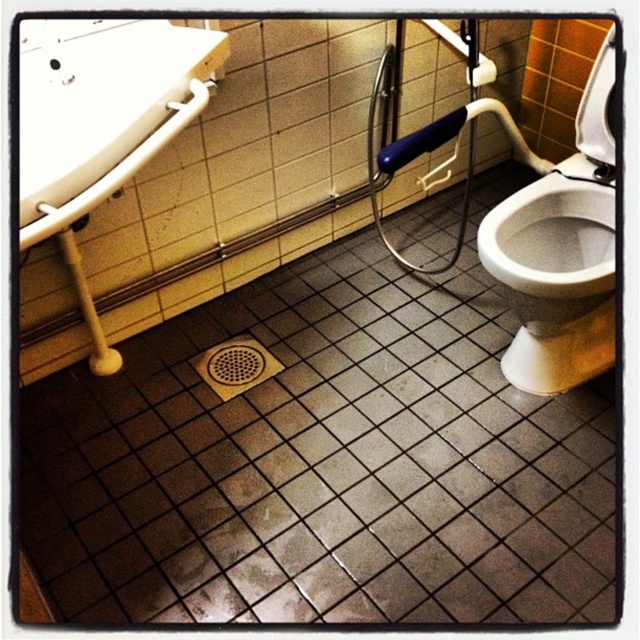
You are standing in the bathroom and need to locate the white glossy sink at upper left and the brown textured drain at center. Which object is closer to the left wall?

The white glossy sink at upper left is closer to the left wall since it is positioned on the left side of the brown textured drain at center.

You are standing in the bathroom and want to reach a specific point on the floor marked at coordinates point (368,445). If you are currently 1.5 meters away from that point, how much further do you need to move forward to reach it?

The distance of point (368,445) from viewer is 1.70 meters. Since you are currently 1.5 meters away, you need to move forward an additional 0.2 meters to reach the point.

You are standing at the entrance of the bathroom and see two points marked on the floor. The first point is at coordinate point (113, 621) and the second is at point (232, 371). Which point is closer to you as you face the bathroom?

Point (113, 621) is in front of point (232, 371), so it is closer to you as you face the bathroom.